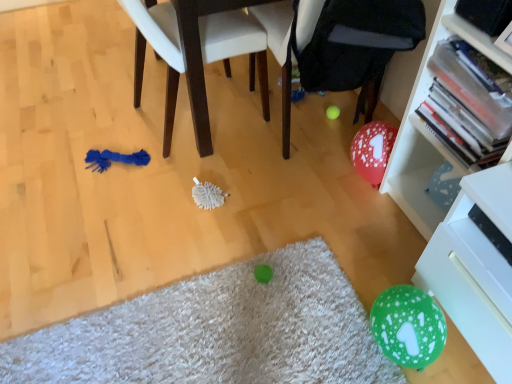
Question: Considering the relative positions of green fuzzy mat at lower center and white plastic bookcase at right in the image provided, is green fuzzy mat at lower center to the left or to the right of white plastic bookcase at right?

Choices:
 (A) left
 (B) right

Answer: (A)

Question: Relative to white plastic bookcase at right, is green fuzzy mat at lower center in front or behind?

Choices:
 (A) behind
 (B) front

Answer: (A)

Question: Which of these objects is positioned farthest from the blue fabric chair at left?

Choices:
 (A) white bristle brush at center
 (B) black fabric bean bag chair at center
 (C) white glossy drawer at lower right
 (D) green fuzzy mat at lower center
 (E) white plastic bookcase at right

Answer: (C)

Question: Which is nearer to the white plastic bookcase at right?

Choices:
 (A) black fabric bean bag chair at center
 (B) blue fabric chair at left
 (C) white bristle brush at center
 (D) green fuzzy mat at lower center
 (E) white glossy drawer at lower right

Answer: (A)